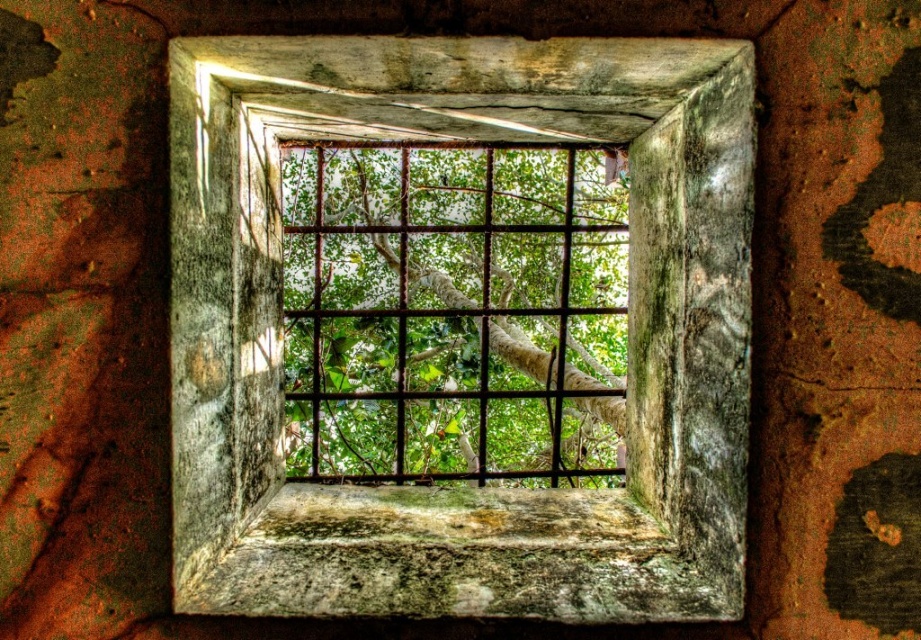
Question: Does rusty metal window frame at center have a greater width compared to green leafy tree at center?

Choices:
 (A) yes
 (B) no

Answer: (B)

Question: Does rusty metal window frame at center have a greater width compared to green leafy tree at center?

Choices:
 (A) yes
 (B) no

Answer: (B)

Question: Is rusty metal window frame at center positioned before green leafy tree at center?

Choices:
 (A) no
 (B) yes

Answer: (B)

Question: Among these objects, which one is nearest to the camera?

Choices:
 (A) rusty metal window frame at center
 (B) green leafy tree at center

Answer: (A)

Question: Which point appears closest to the camera in this image?

Choices:
 (A) (423, 230)
 (B) (634, 586)

Answer: (B)